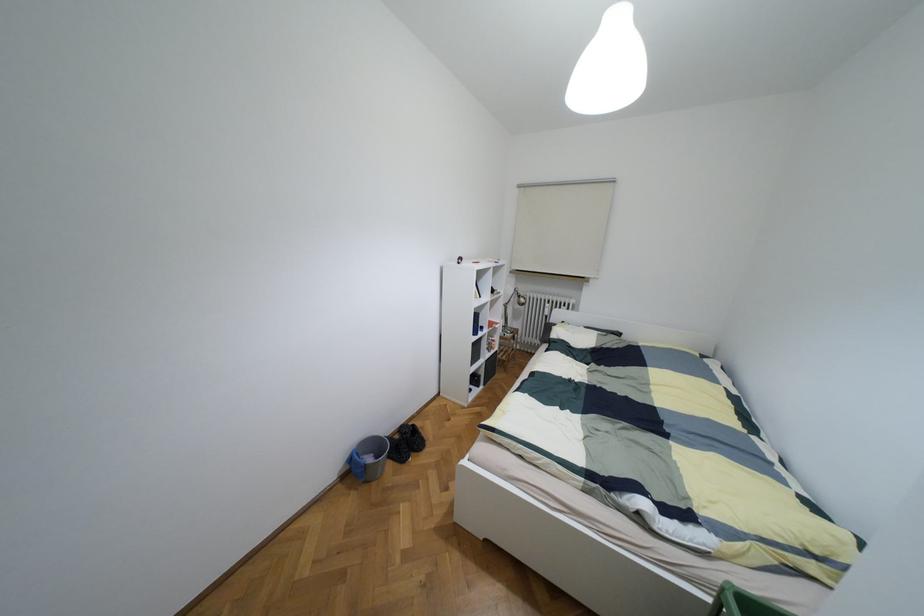
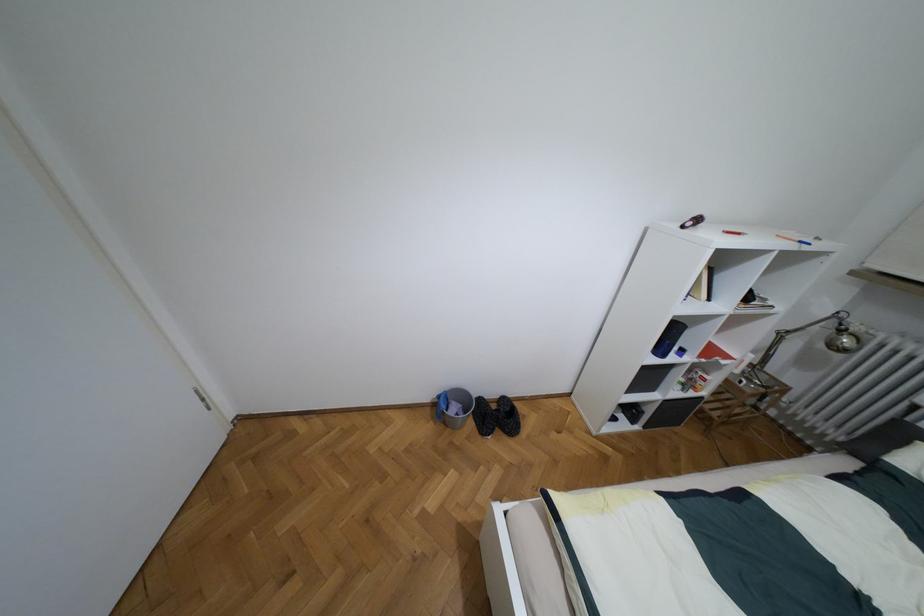
Where in the second image is the point corresponding to [369,459] from the first image?

(453, 408)